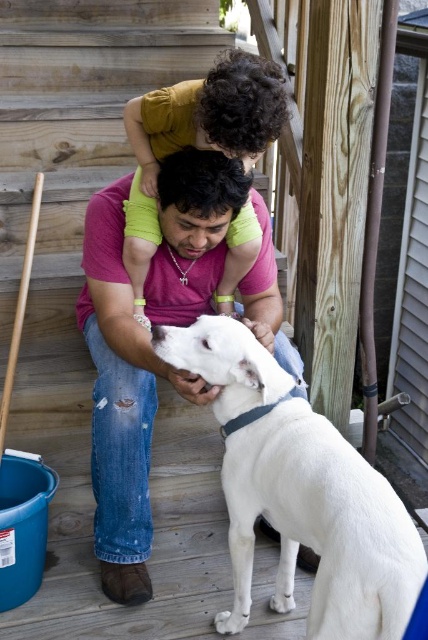
Question: Which point is closer to the camera?

Choices:
 (A) white matte dog at center
 (B) matte pink shirt at center

Answer: (A)

Question: Is white matte dog at center bigger than matte pink shirt at center?

Choices:
 (A) no
 (B) yes

Answer: (A)

Question: From the image, what is the correct spatial relationship of white matte dog at center in relation to matte pink shirt at center?

Choices:
 (A) above
 (B) below

Answer: (B)

Question: Among these objects, which one is nearest to the camera?

Choices:
 (A) matte pink shirt at center
 (B) white matte dog at center

Answer: (B)

Question: Can you confirm if white matte dog at center is wider than matte pink shirt at center?

Choices:
 (A) yes
 (B) no

Answer: (B)

Question: Which of the following is the farthest from the observer?

Choices:
 (A) (85, 230)
 (B) (326, 604)

Answer: (A)